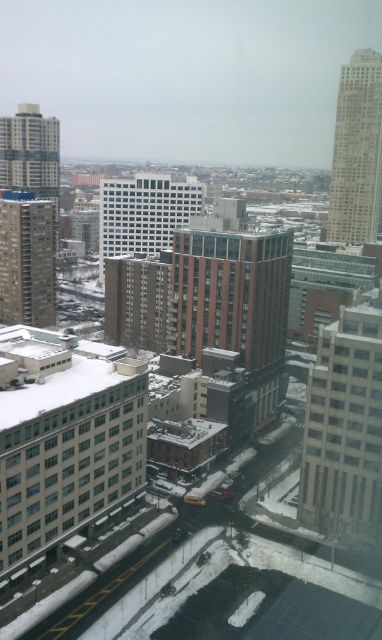
Is white glass windows at lower left further to camera compared to white glass building at center?

No, it is in front of white glass building at center.

This screenshot has width=382, height=640. What do you see at coordinates (66, 452) in the screenshot?
I see `white glass windows at lower left` at bounding box center [66, 452].

Between point (126, 392) and point (197, 193), which one is positioned behind?

Positioned behind is point (197, 193).

Identify the location of white glass windows at lower left. Image resolution: width=382 pixels, height=640 pixels. (66, 452).